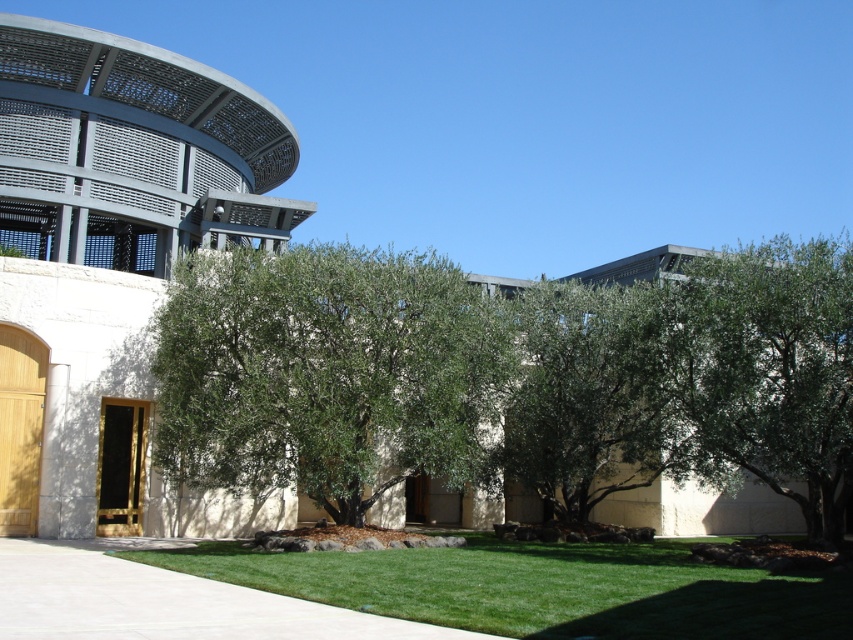
Is green leafy tree at right positioned behind green leafy tree at center?

No, it is in front of green leafy tree at center.

Is point (759, 365) positioned before point (548, 397)?

Yes, it is.

Locate an element on the screen. This screenshot has width=853, height=640. green leafy tree at right is located at coordinates (764, 372).

Can you confirm if green lawn at center is wider than green leafy tree at center?

Yes, green lawn at center is wider than green leafy tree at center.

Does green lawn at center have a larger size compared to green leafy tree at center?

No, green lawn at center is not bigger than green leafy tree at center.

Which is behind, point (743, 621) or point (645, 300)?

Positioned behind is point (645, 300).

Find the location of a particular element. The height and width of the screenshot is (640, 853). green lawn at center is located at coordinates (543, 588).

Is green leafy olive tree at center smaller than green leafy tree at center?

Actually, green leafy olive tree at center might be larger than green leafy tree at center.

Find the location of a particular element. The image size is (853, 640). green leafy olive tree at center is located at coordinates (328, 372).

Locate an element on the screen. green leafy olive tree at center is located at coordinates (328, 372).